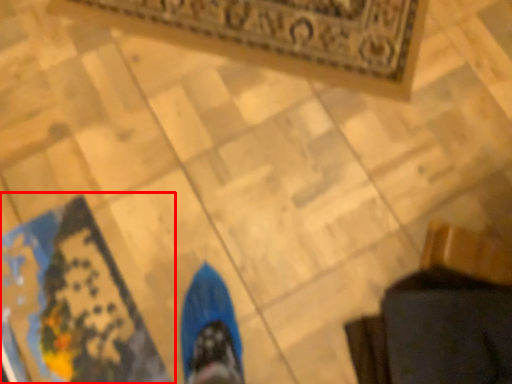
Question: Where is mat (annotated by the red box) located in relation to mat in the image?

Choices:
 (A) left
 (B) right

Answer: (A)